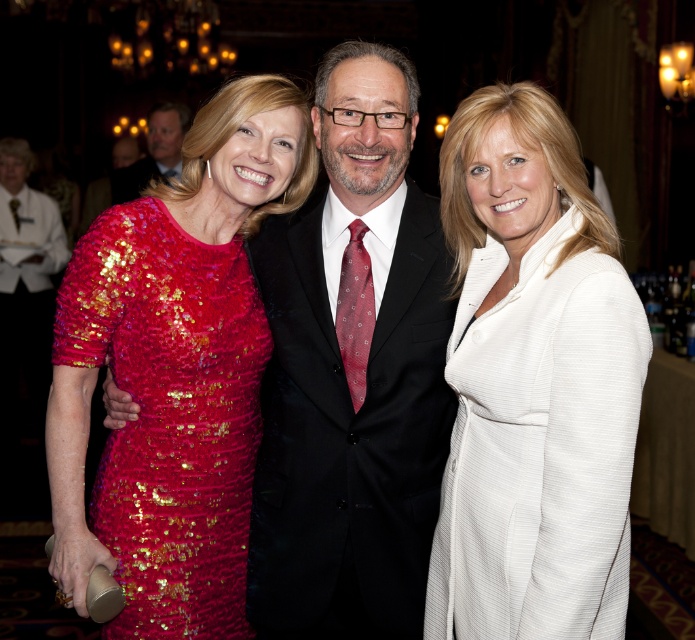
You are standing in the banquet hall and notice two points marked on the floor. One is at coordinate point (348, 342) and the other at point (10, 202). Which point is closer to you?

Point (348, 342) is closer to the viewer than point (10, 202).

You are a photographer at the event and need to adjust the lighting so that both the sequined red dress at left and the matte red tie at center are equally visible. Given their distance apart, is this possible without moving either object? Please explain.

The sequined red dress at left is 5.61 meters from the matte red tie at center. Since the distance between them is significant, adjusting the lighting to equally illuminate both might be challenging without moving either object. However, using directional lighting or multiple light sources could help achieve balanced visibility.

You are standing in the banquet hall and want to take a photo of the group. The camera you are using has a focal length of 50mm. If the white textured coat at center is located at coordinates point 0.600, 0.768, where would you position the camera to ensure the entire group is in frame?

To capture the entire group in frame with the camera at 50mm focal length, position the camera centrally relative to the group, ensuring the white textured coat at center is within the frame at its coordinates point (532, 384). Adjust the camera angle slightly to include all three individuals.